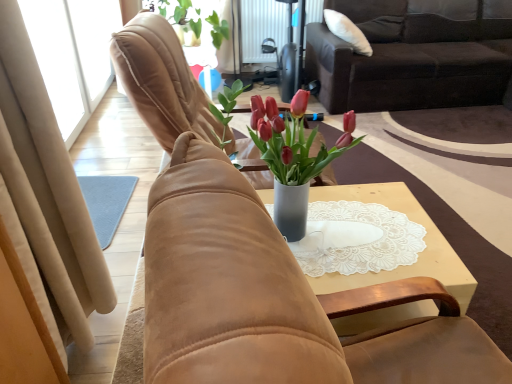
Question: Is metallic radiator at upper center to the left of suede chair at center, the 1th chair in the back-to-front sequence, from the viewer's perspective?

Choices:
 (A) no
 (B) yes

Answer: (A)

Question: Is there a large distance between metallic radiator at upper center and suede chair at center, the 1th chair in the back-to-front sequence?

Choices:
 (A) no
 (B) yes

Answer: (B)

Question: Is metallic radiator at upper center shorter than suede chair at center, the 1th chair in the back-to-front sequence?

Choices:
 (A) yes
 (B) no

Answer: (A)

Question: Is metallic radiator at upper center placed right next to suede chair at center, the 1th chair in the back-to-front sequence?

Choices:
 (A) no
 (B) yes

Answer: (A)

Question: Is metallic radiator at upper center at the right side of suede chair at center, which is the 2th chair from front to back?

Choices:
 (A) yes
 (B) no

Answer: (A)

Question: Is metallic radiator at upper center taller than suede chair at center, the 1th chair in the back-to-front sequence?

Choices:
 (A) yes
 (B) no

Answer: (B)

Question: Is there a large distance between suede chair at center, the 2th chair positioned from the back, and suede chair at center, the 1th chair in the back-to-front sequence?

Choices:
 (A) yes
 (B) no

Answer: (A)

Question: Could you tell me if suede chair at center, positioned as the 1th chair in front-to-back order, is facing suede chair at center, the 1th chair in the back-to-front sequence?

Choices:
 (A) yes
 (B) no

Answer: (B)

Question: Is suede chair at center, the 2th chair positioned from the back, smaller than suede chair at center, the 1th chair in the back-to-front sequence?

Choices:
 (A) no
 (B) yes

Answer: (B)

Question: From a real-world perspective, is suede chair at center, the 2th chair positioned from the back, physically above suede chair at center, the 1th chair in the back-to-front sequence?

Choices:
 (A) yes
 (B) no

Answer: (A)

Question: Considering the relative positions of suede chair at center, the 2th chair positioned from the back, and suede chair at center, the 1th chair in the back-to-front sequence, in the image provided, is suede chair at center, the 2th chair positioned from the back, to the left of suede chair at center, the 1th chair in the back-to-front sequence, from the viewer's perspective?

Choices:
 (A) yes
 (B) no

Answer: (B)

Question: Does suede chair at center, the 2th chair positioned from the back, have a lesser width compared to suede chair at center, which is the 2th chair from front to back?

Choices:
 (A) yes
 (B) no

Answer: (A)

Question: From the image's perspective, is suede chair at center, the 1th chair in the back-to-front sequence, located beneath dark brown fabric couch at upper right?

Choices:
 (A) yes
 (B) no

Answer: (A)